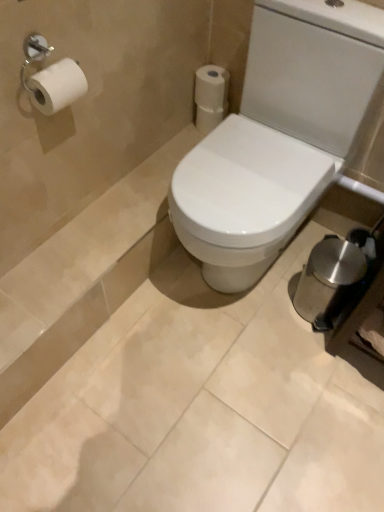
Question: Does white glossy toilet at center appear on the left side of white matte toilet paper at upper right, placed as the 1th toilet paper when sorted from front to back?

Choices:
 (A) no
 (B) yes

Answer: (A)

Question: Can you confirm if white glossy toilet at center is shorter than white matte toilet paper at upper right, positioned as the 2th toilet paper in back-to-front order?

Choices:
 (A) yes
 (B) no

Answer: (B)

Question: Is white matte toilet paper at upper right, positioned as the 2th toilet paper in back-to-front order, located within white glossy toilet at center?

Choices:
 (A) no
 (B) yes

Answer: (A)

Question: Is white glossy toilet at center further to the viewer compared to white matte toilet paper at upper right, placed as the 1th toilet paper when sorted from front to back?

Choices:
 (A) no
 (B) yes

Answer: (A)

Question: From the image's perspective, is white glossy toilet at center located beneath white matte toilet paper at upper right, positioned as the 2th toilet paper in back-to-front order?

Choices:
 (A) yes
 (B) no

Answer: (A)

Question: Can we say white glossy toilet at center lies outside white matte toilet paper at upper right, placed as the 1th toilet paper when sorted from front to back?

Choices:
 (A) no
 (B) yes

Answer: (B)

Question: Is white matte toilet paper at upper right, positioned as the 2th toilet paper in back-to-front order, oriented towards white matte toilet paper at upper center, acting as the 2th toilet paper starting from the front?

Choices:
 (A) no
 (B) yes

Answer: (A)

Question: Does white matte toilet paper at upper right, placed as the 1th toilet paper when sorted from front to back, contain white matte toilet paper at upper center, acting as the 2th toilet paper starting from the front?

Choices:
 (A) no
 (B) yes

Answer: (A)

Question: Is white matte toilet paper at upper right, positioned as the 2th toilet paper in back-to-front order, not inside white matte toilet paper at upper center, arranged as the first toilet paper when viewed from the back?

Choices:
 (A) no
 (B) yes

Answer: (B)

Question: Does white matte toilet paper at upper right, positioned as the 2th toilet paper in back-to-front order, come in front of white matte toilet paper at upper center, acting as the 2th toilet paper starting from the front?

Choices:
 (A) no
 (B) yes

Answer: (B)

Question: From a real-world perspective, is white matte toilet paper at upper right, placed as the 1th toilet paper when sorted from front to back, positioned over white matte toilet paper at upper center, acting as the 2th toilet paper starting from the front, based on gravity?

Choices:
 (A) yes
 (B) no

Answer: (A)

Question: Considering the relative sizes of white matte toilet paper at upper right, placed as the 1th toilet paper when sorted from front to back, and white matte toilet paper at upper center, acting as the 2th toilet paper starting from the front, in the image provided, is white matte toilet paper at upper right, placed as the 1th toilet paper when sorted from front to back, shorter than white matte toilet paper at upper center, acting as the 2th toilet paper starting from the front,?

Choices:
 (A) yes
 (B) no

Answer: (A)

Question: Is white glossy toilet at center far away from white matte toilet paper at upper center, arranged as the first toilet paper when viewed from the back?

Choices:
 (A) no
 (B) yes

Answer: (A)